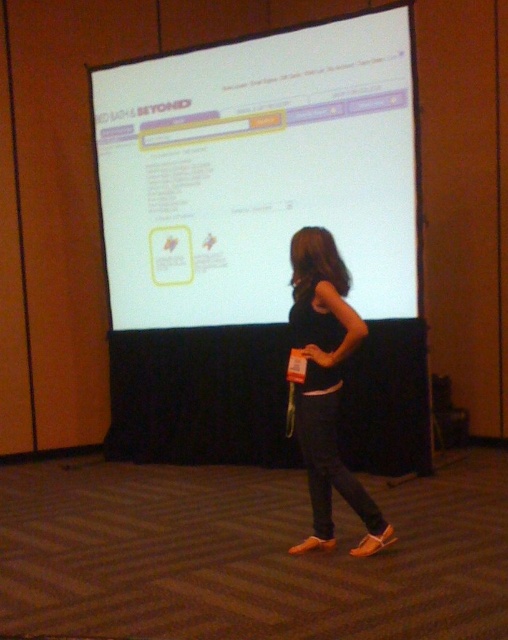
You are standing in a room where a person is facing a projection screen. You notice a point at coordinates [258,172]. What object is located at that point?

The white glossy projection screen at upper center is located at point [258,172].

You are setting up a camera to capture both the white glossy projection screen at upper center and the black fabric dress at center. Since the screen is bright, you want to ensure the dress is not too dark in comparison. Based on their sizes, which object should you adjust the camera exposure for first?

The white glossy projection screen at upper center is wider than the black fabric dress at center, so you should adjust the camera exposure for the white glossy projection screen at upper center first to balance the brightness and prevent the dress from appearing too dark.